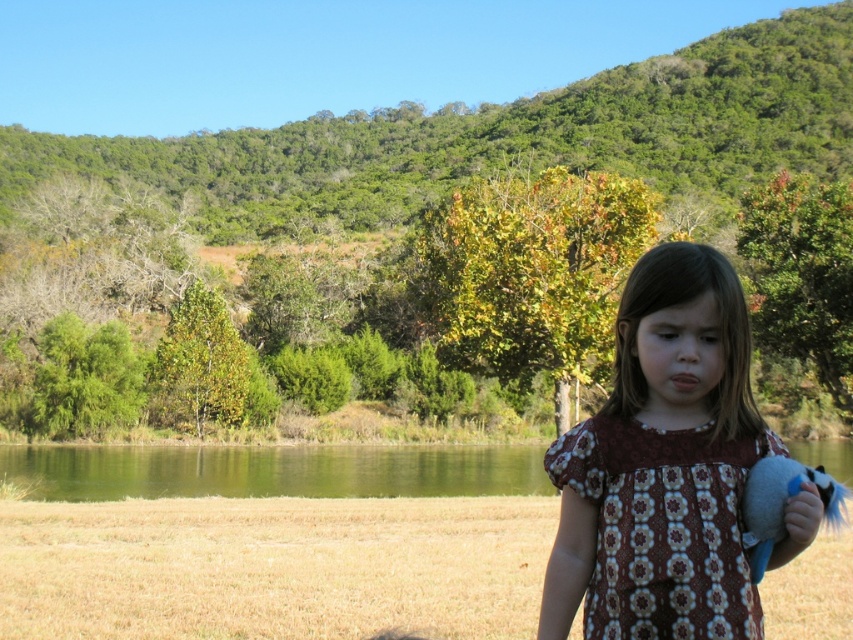
Looking at this image, is brown floral fabric dress at center smaller than green liquid water at lower center?

Indeed, brown floral fabric dress at center has a smaller size compared to green liquid water at lower center.

Is point (567, 433) farther from viewer compared to point (183, 472)?

No.

Identify the location of brown floral fabric dress at center. The height and width of the screenshot is (640, 853). (663, 528).

Where is `brown floral fabric dress at center`? brown floral fabric dress at center is located at coordinates (663, 528).

Is brown floral fabric dress at center to the left of fluffy plush toy at lower right from the viewer's perspective?

Correct, you'll find brown floral fabric dress at center to the left of fluffy plush toy at lower right.

Which is more to the left, brown floral fabric dress at center or fluffy plush toy at lower right?

brown floral fabric dress at center is more to the left.

Image resolution: width=853 pixels, height=640 pixels. Find the location of `brown floral fabric dress at center`. brown floral fabric dress at center is located at coordinates (663, 528).

Which is above, brown printed dress at center or green liquid water at lower center?

Positioned higher is brown printed dress at center.

Is point (758, 449) in front of point (253, 451)?

That is True.

The width and height of the screenshot is (853, 640). Identify the location of brown printed dress at center. (662, 467).